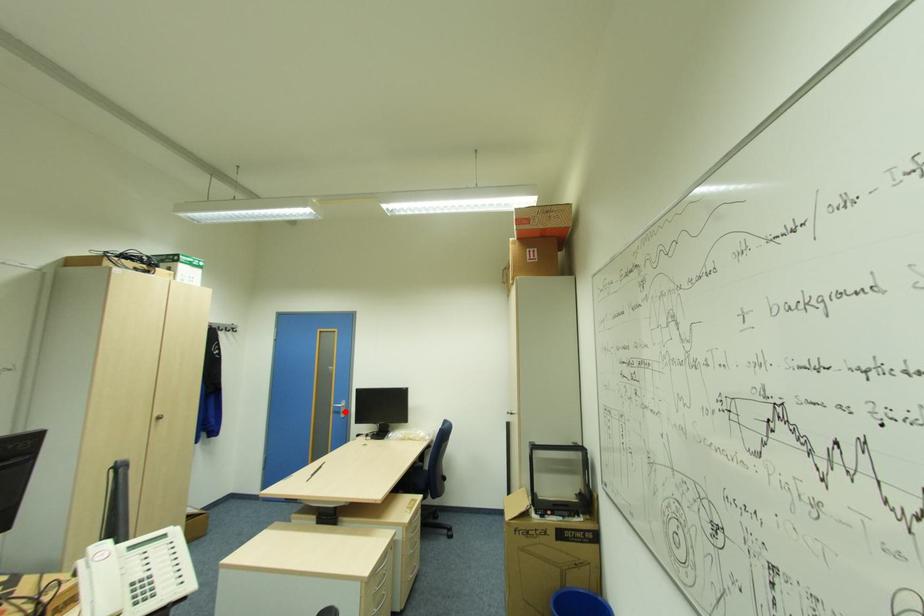
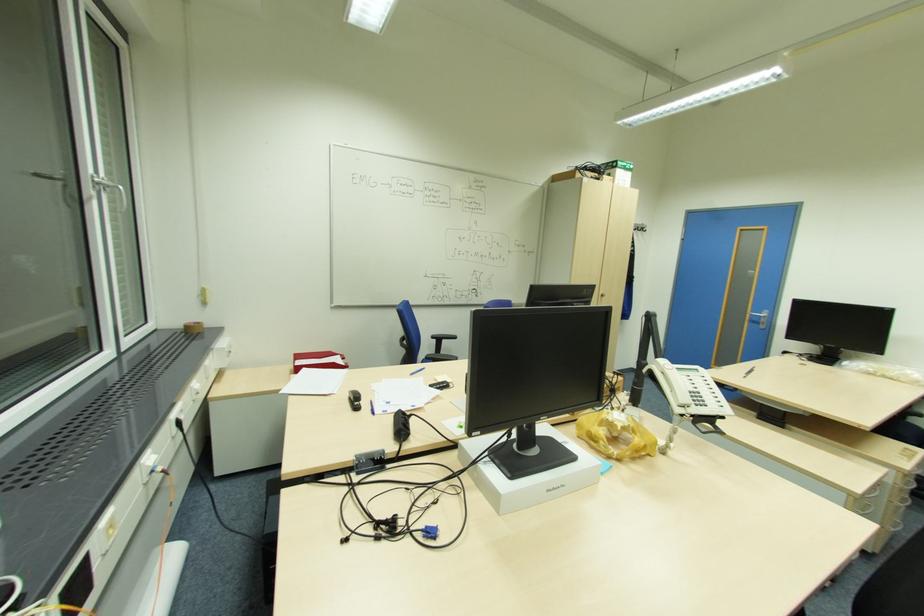
Question: I am providing you with two images of the same scene from different viewpoints. Given a red point in image1, look at the same physical point in image2. Is it:

Choices:
 (A) Closer to the viewpoint
 (B) Farther from the viewpoint

Answer: (A)